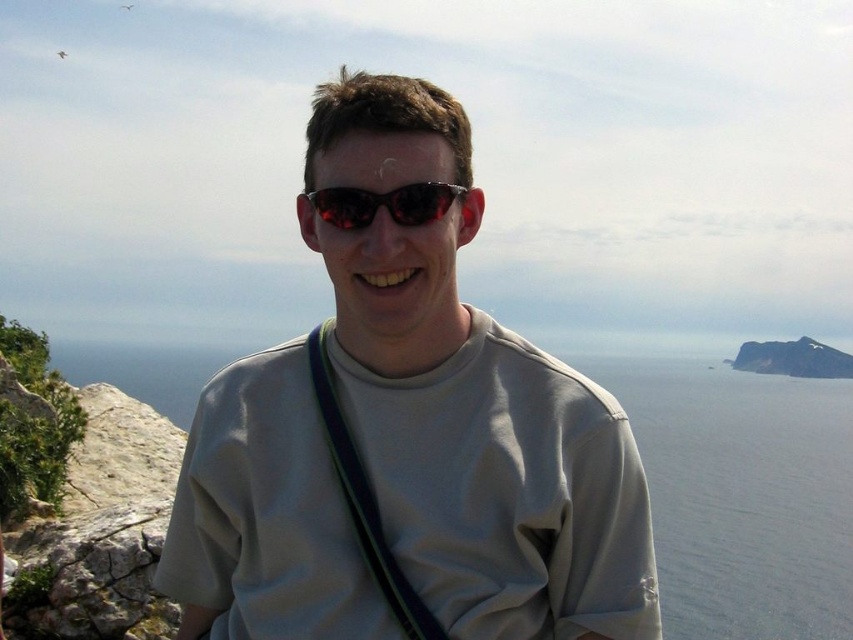
Question: From the image, what is the correct spatial relationship of gray matte shirt at center in relation to black fabric strap at center?

Choices:
 (A) below
 (B) above

Answer: (A)

Question: Among these points, which one is nearest to the camera?

Choices:
 (A) (363, 525)
 (B) (392, 193)

Answer: (A)

Question: Which of the following is the closest to the observer?

Choices:
 (A) black fabric strap at center
 (B) shiny dark sunglasses at center

Answer: (A)

Question: Does gray matte shirt at center have a lesser width compared to black fabric strap at center?

Choices:
 (A) yes
 (B) no

Answer: (B)

Question: Which point is closer to the camera?

Choices:
 (A) (368, 540)
 (B) (422, 200)

Answer: (A)

Question: Does black fabric strap at center lie behind shiny dark sunglasses at center?

Choices:
 (A) yes
 (B) no

Answer: (B)